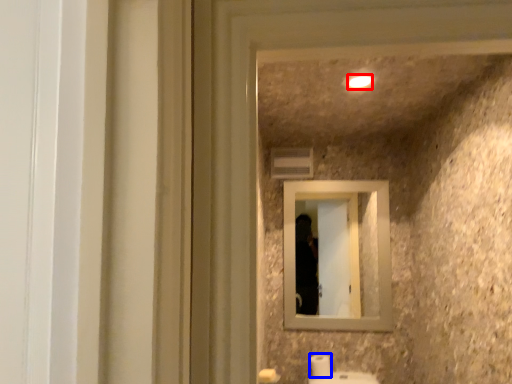
Question: Which object is further to the camera taking this photo, light (highlighted by a red box) or toilet paper (highlighted by a blue box)?

Choices:
 (A) light
 (B) toilet paper

Answer: (B)